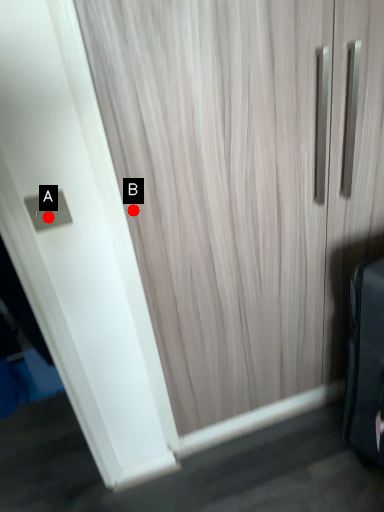
Question: Two points are circled on the image, labeled by A and B beside each circle. Among these points, which one is farthest from the camera?

Choices:
 (A) A is further
 (B) B is further

Answer: (B)